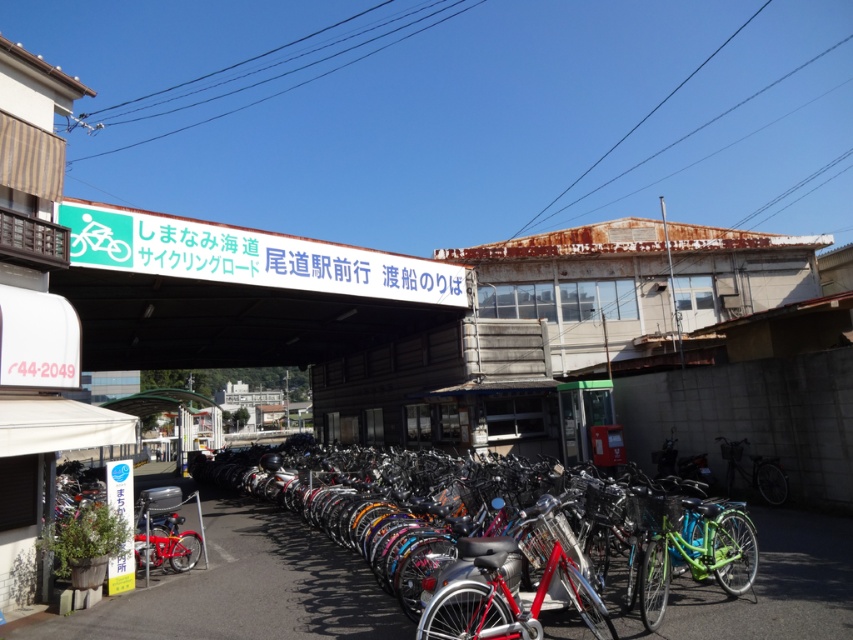
Question: Which point is closer to the camera?

Choices:
 (A) shiny metallic bicycle at center
 (B) green signboard at upper center

Answer: (A)

Question: Which point is farther to the camera?

Choices:
 (A) green signboard at upper center
 (B) shiny red bicycle at center

Answer: (A)

Question: Where is shiny metallic bicycle at center located in relation to green matte bicycle at center in the image?

Choices:
 (A) above
 (B) below

Answer: (B)

Question: Considering the relative positions of green signboard at upper center and shiny red bicycle at center in the image provided, where is green signboard at upper center located with respect to shiny red bicycle at center?

Choices:
 (A) below
 (B) above

Answer: (B)

Question: Where is green signboard at upper center located in relation to green matte bicycle at center in the image?

Choices:
 (A) below
 (B) above

Answer: (A)

Question: Which object is the farthest from the green signboard at upper center?

Choices:
 (A) green matte bicycle at center
 (B) shiny red bicycle at center
 (C) shiny metallic bicycle at center

Answer: (B)